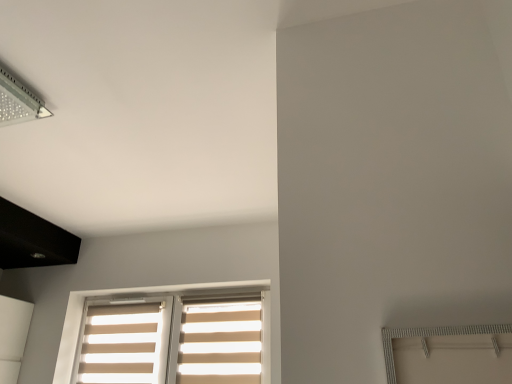
Identify the location of beige fabric curtain at lower left, marked as the 2th curtain in a right-to-left arrangement. (122, 344).

From the image's perspective, does beige fabric curtain at lower center, which is the second curtain in left-to-right order, appear higher than transparent plastic lamp at upper left?

Actually, beige fabric curtain at lower center, which is the second curtain in left-to-right order, appears below transparent plastic lamp at upper left in the image.

Choose the correct answer: Is beige fabric curtain at lower center, placed as the first curtain when sorted from right to left, inside transparent plastic lamp at upper left or outside it?

beige fabric curtain at lower center, placed as the first curtain when sorted from right to left, is spatially situated outside transparent plastic lamp at upper left.

Which of these two, beige fabric curtain at lower center, placed as the first curtain when sorted from right to left, or transparent plastic lamp at upper left, is thinner?

beige fabric curtain at lower center, placed as the first curtain when sorted from right to left.

Is beige fabric curtain at lower left, placed as the 1th curtain when sorted from left to right, inside the boundaries of beige fabric curtain at lower center, placed as the first curtain when sorted from right to left, or outside?

beige fabric curtain at lower left, placed as the 1th curtain when sorted from left to right, is spatially situated outside beige fabric curtain at lower center, placed as the first curtain when sorted from right to left.

Is beige fabric curtain at lower left, marked as the 2th curtain in a right-to-left arrangement, wider than beige fabric curtain at lower center, placed as the first curtain when sorted from right to left?

Indeed, beige fabric curtain at lower left, marked as the 2th curtain in a right-to-left arrangement, has a greater width compared to beige fabric curtain at lower center, placed as the first curtain when sorted from right to left.

Can you confirm if beige fabric blinds at lower center is positioned to the left of beige fabric curtain at lower center, placed as the first curtain when sorted from right to left?

Yes.

The width and height of the screenshot is (512, 384). Find the location of `window above the beige fabric curtain at lower center, placed as the first curtain when sorted from right to left (from a real-world perspective)`. window above the beige fabric curtain at lower center, placed as the first curtain when sorted from right to left (from a real-world perspective) is located at coordinates (144, 293).

From a real-world perspective, which object rests below the other?

beige fabric curtain at lower center, which is the second curtain in left-to-right order, from a real-world perspective.

Considering the sizes of objects beige fabric blinds at lower center and beige fabric curtain at lower center, placed as the first curtain when sorted from right to left, in the image provided, who is smaller, beige fabric blinds at lower center or beige fabric curtain at lower center, placed as the first curtain when sorted from right to left,?

With smaller size is beige fabric curtain at lower center, placed as the first curtain when sorted from right to left.

Does transparent plastic lamp at upper left turn towards beige fabric curtain at lower center, placed as the first curtain when sorted from right to left?

No, transparent plastic lamp at upper left is not oriented towards beige fabric curtain at lower center, placed as the first curtain when sorted from right to left.

Which is behind, point (6, 110) or point (182, 329)?

Positioned behind is point (182, 329).

From a real-world perspective, does transparent plastic lamp at upper left sit lower than beige fabric curtain at lower center, placed as the first curtain when sorted from right to left?

No, from a real-world perspective, transparent plastic lamp at upper left is not under beige fabric curtain at lower center, placed as the first curtain when sorted from right to left.

Considering the relative positions of transparent plastic lamp at upper left and beige fabric curtain at lower center, which is the second curtain in left-to-right order, in the image provided, is transparent plastic lamp at upper left to the right of beige fabric curtain at lower center, which is the second curtain in left-to-right order, from the viewer's perspective?

Incorrect, transparent plastic lamp at upper left is not on the right side of beige fabric curtain at lower center, which is the second curtain in left-to-right order.

Is transparent plastic lamp at upper left placed right next to beige fabric blinds at lower center?

No, transparent plastic lamp at upper left is not next to beige fabric blinds at lower center.

Between transparent plastic lamp at upper left and beige fabric blinds at lower center, which one appears on the right side from the viewer's perspective?

beige fabric blinds at lower center is more to the right.

Can you confirm if transparent plastic lamp at upper left is taller than beige fabric blinds at lower center?

In fact, transparent plastic lamp at upper left may be shorter than beige fabric blinds at lower center.

From the picture: Considering the positions of objects beige fabric curtain at lower center, placed as the first curtain when sorted from right to left, and beige fabric blinds at lower center in the image provided, who is in front, beige fabric curtain at lower center, placed as the first curtain when sorted from right to left, or beige fabric blinds at lower center?

beige fabric blinds at lower center is more forward.

Is beige fabric blinds at lower center at the back of beige fabric curtain at lower center, placed as the first curtain when sorted from right to left?

Yes, beige fabric curtain at lower center, placed as the first curtain when sorted from right to left, is positioned with its back facing beige fabric blinds at lower center.

Is beige fabric curtain at lower center, placed as the first curtain when sorted from right to left, bigger or smaller than beige fabric blinds at lower center?

Considering their sizes, beige fabric curtain at lower center, placed as the first curtain when sorted from right to left, takes up less space than beige fabric blinds at lower center.

In terms of height, does beige fabric curtain at lower left, marked as the 2th curtain in a right-to-left arrangement, look taller or shorter compared to beige fabric blinds at lower center?

beige fabric curtain at lower left, marked as the 2th curtain in a right-to-left arrangement, is shorter than beige fabric blinds at lower center.

Starting from the beige fabric blinds at lower center, which curtain is the 2nd one behind? Please provide its 2D coordinates.

[(122, 344)]

Considering the relative positions of beige fabric curtain at lower left, marked as the 2th curtain in a right-to-left arrangement, and beige fabric blinds at lower center in the image provided, is beige fabric curtain at lower left, marked as the 2th curtain in a right-to-left arrangement, to the left of beige fabric blinds at lower center from the viewer's perspective?

Correct, you'll find beige fabric curtain at lower left, marked as the 2th curtain in a right-to-left arrangement, to the left of beige fabric blinds at lower center.

Find the location of a particular element. lamp that appears on the left of beige fabric curtain at lower center, which is the second curtain in left-to-right order is located at coordinates (18, 101).

Where is `curtain below the beige fabric curtain at lower left, marked as the 2th curtain in a right-to-left arrangement (from a real-world perspective)`? The width and height of the screenshot is (512, 384). curtain below the beige fabric curtain at lower left, marked as the 2th curtain in a right-to-left arrangement (from a real-world perspective) is located at coordinates (220, 343).

From the image, which object appears to be nearer to beige fabric curtain at lower left, placed as the 1th curtain when sorted from left to right, beige fabric blinds at lower center or transparent plastic lamp at upper left?

Based on the image, beige fabric blinds at lower center appears to be nearer to beige fabric curtain at lower left, placed as the 1th curtain when sorted from left to right.

From the image, which object appears to be nearer to beige fabric blinds at lower center, beige fabric curtain at lower center, which is the second curtain in left-to-right order, or transparent plastic lamp at upper left?

Based on the image, beige fabric curtain at lower center, which is the second curtain in left-to-right order, appears to be nearer to beige fabric blinds at lower center.

Based on the photo, estimate the real-world distances between objects in this image. Which object is closer to beige fabric curtain at lower left, placed as the 1th curtain when sorted from left to right, beige fabric curtain at lower center, which is the second curtain in left-to-right order, or transparent plastic lamp at upper left?

beige fabric curtain at lower center, which is the second curtain in left-to-right order, is positioned closer to the anchor beige fabric curtain at lower left, placed as the 1th curtain when sorted from left to right.

Estimate the real-world distances between objects in this image. Which object is further from beige fabric blinds at lower center, beige fabric curtain at lower left, marked as the 2th curtain in a right-to-left arrangement, or beige fabric curtain at lower center, which is the second curtain in left-to-right order?

beige fabric curtain at lower center, which is the second curtain in left-to-right order.

Looking at this image, based on their spatial positions, is transparent plastic lamp at upper left or beige fabric curtain at lower center, placed as the first curtain when sorted from right to left, further from beige fabric blinds at lower center?

transparent plastic lamp at upper left lies further to beige fabric blinds at lower center than the other object.

When comparing their distances from transparent plastic lamp at upper left, does beige fabric blinds at lower center or beige fabric curtain at lower left, placed as the 1th curtain when sorted from left to right, seem further?

The object further to transparent plastic lamp at upper left is beige fabric curtain at lower left, placed as the 1th curtain when sorted from left to right.

From the image, which object appears to be farther from beige fabric curtain at lower center, placed as the first curtain when sorted from right to left, beige fabric curtain at lower left, placed as the 1th curtain when sorted from left to right, or beige fabric blinds at lower center?

beige fabric curtain at lower left, placed as the 1th curtain when sorted from left to right, lies further to beige fabric curtain at lower center, placed as the first curtain when sorted from right to left, than the other object.

Considering their positions, is transparent plastic lamp at upper left positioned further to beige fabric curtain at lower center, placed as the first curtain when sorted from right to left, than beige fabric curtain at lower left, marked as the 2th curtain in a right-to-left arrangement?

transparent plastic lamp at upper left.

Where is `window between transparent plastic lamp at upper left and beige fabric curtain at lower left, placed as the 1th curtain when sorted from left to right, from top to bottom`? window between transparent plastic lamp at upper left and beige fabric curtain at lower left, placed as the 1th curtain when sorted from left to right, from top to bottom is located at coordinates (144, 293).

The image size is (512, 384). What are the coordinates of `window between beige fabric curtain at lower left, placed as the 1th curtain when sorted from left to right, and beige fabric curtain at lower center, placed as the first curtain when sorted from right to left, in the horizontal direction` in the screenshot? It's located at (144, 293).

I want to click on curtain between transparent plastic lamp at upper left and beige fabric blinds at lower center in the vertical direction, so click(220, 343).

This screenshot has height=384, width=512. I want to click on curtain between transparent plastic lamp at upper left and beige fabric curtain at lower left, marked as the 2th curtain in a right-to-left arrangement, in the vertical direction, so click(x=220, y=343).